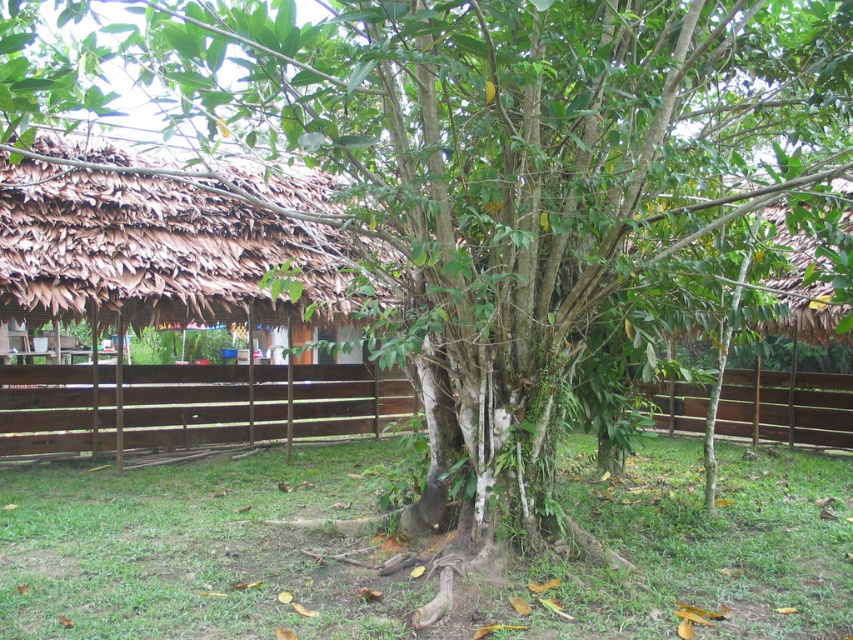
Question: Which object appears farthest from the camera in this image?

Choices:
 (A) brown wooden fence at center
 (B) brown thatched hut at upper right

Answer: (B)

Question: Which point is farther to the camera?

Choices:
 (A) brown thatch hut at left
 (B) brown wooden fence at center
 (C) brown wooden fence at right
 (D) green grass at center

Answer: (C)

Question: Estimate the real-world distances between objects in this image. Which object is closer to the brown wooden fence at center?

Choices:
 (A) green grass at center
 (B) brown thatch hut at left
 (C) brown wooden fence at right
 (D) brown thatched hut at upper right

Answer: (B)

Question: Can you confirm if brown thatch hut at left is smaller than brown wooden fence at center?

Choices:
 (A) yes
 (B) no

Answer: (A)

Question: Does green grass at center appear under brown thatched hut at upper right?

Choices:
 (A) yes
 (B) no

Answer: (A)

Question: Is brown thatch hut at left to the left of brown thatched hut at upper right from the viewer's perspective?

Choices:
 (A) yes
 (B) no

Answer: (A)